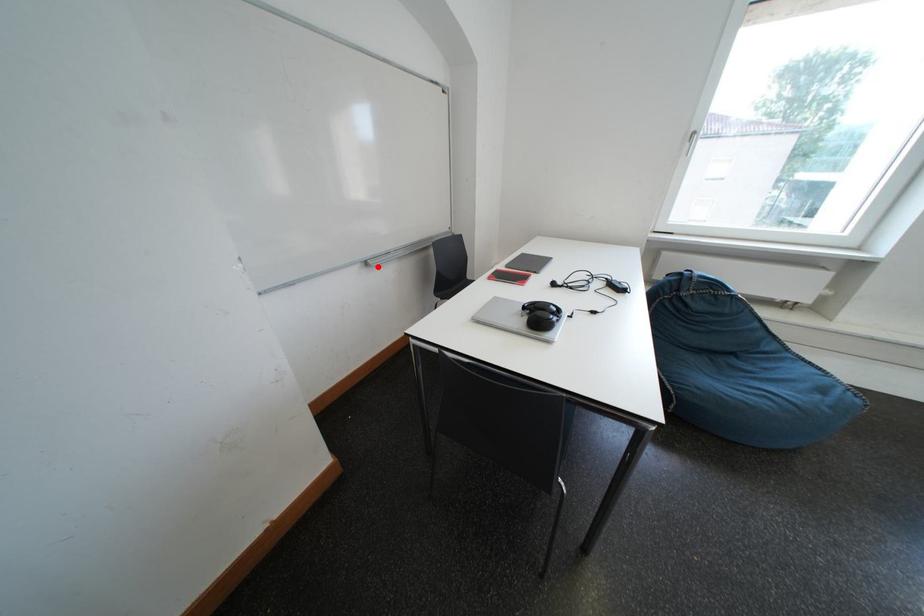
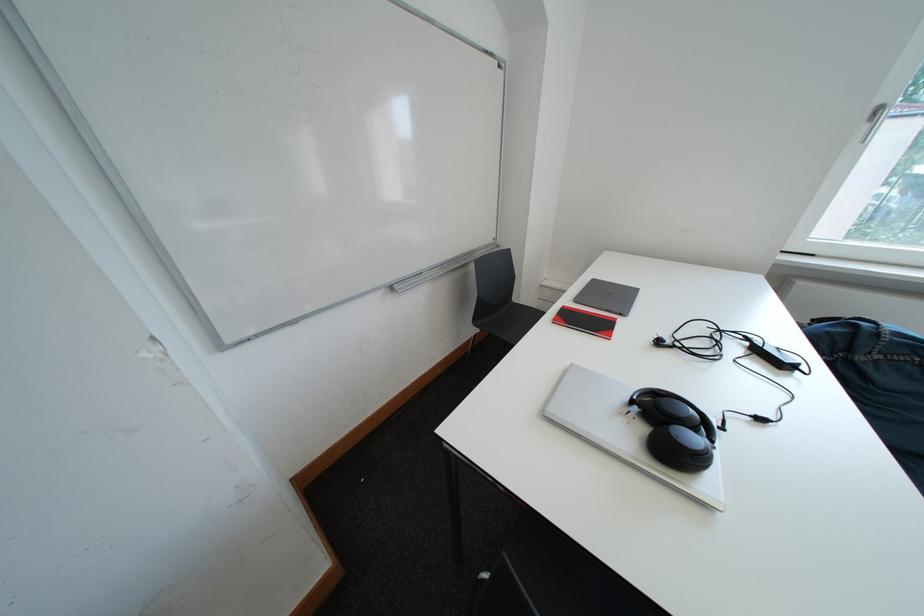
The point at the highlighted location is marked in the first image. Where is the corresponding point in the second image?

(403, 292)